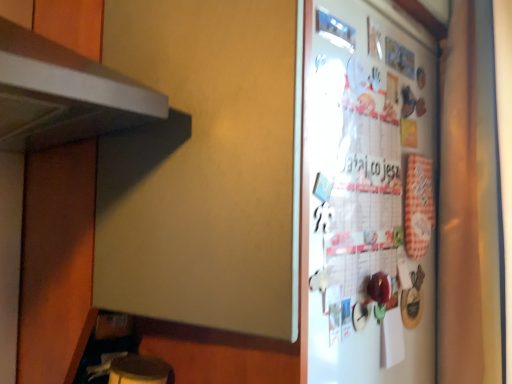
Question: Is white glossy refrigerator at right taller or shorter than white fabric curtain at right?

Choices:
 (A) short
 (B) tall

Answer: (A)

Question: Is white glossy refrigerator at right in front of or behind white fabric curtain at right in the image?

Choices:
 (A) front
 (B) behind

Answer: (A)

Question: Is white glossy refrigerator at right wider or thinner than white fabric curtain at right?

Choices:
 (A) wide
 (B) thin

Answer: (B)

Question: Considering the positions of white fabric curtain at right and white glossy refrigerator at right in the image, is white fabric curtain at right bigger or smaller than white glossy refrigerator at right?

Choices:
 (A) big
 (B) small

Answer: (A)

Question: Is point (482, 81) closer or farther from the camera than point (423, 344)?

Choices:
 (A) farther
 (B) closer

Answer: (B)

Question: Relative to white glossy refrigerator at right, is white fabric curtain at right in front or behind?

Choices:
 (A) front
 (B) behind

Answer: (B)

Question: From a real-world perspective, is white fabric curtain at right above or below white glossy refrigerator at right?

Choices:
 (A) below
 (B) above

Answer: (B)